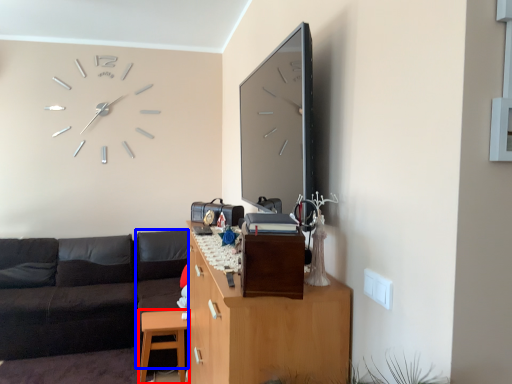
Question: Among these objects, which one is farthest to the camera, table (highlighted by a red box) or couch (highlighted by a blue box)?

Choices:
 (A) table
 (B) couch

Answer: (B)